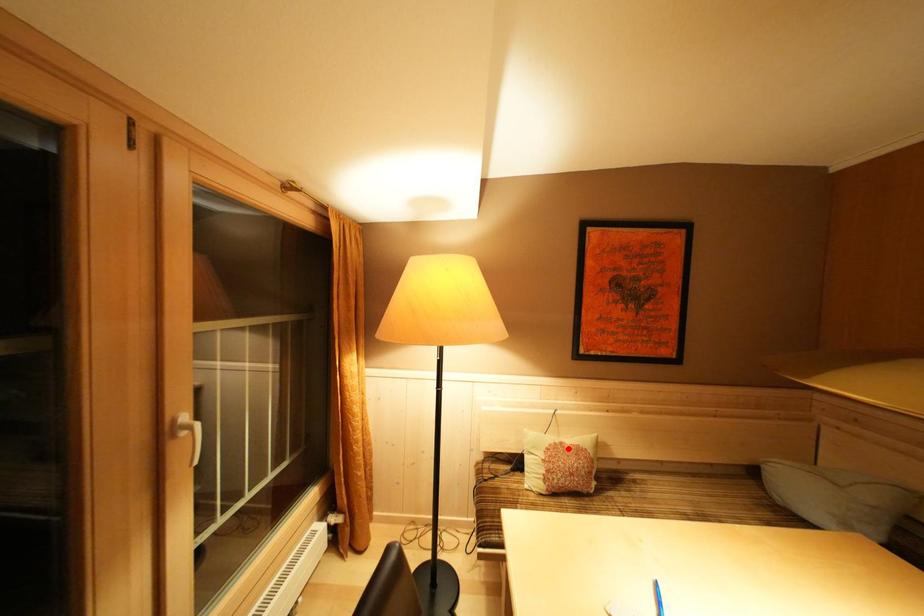
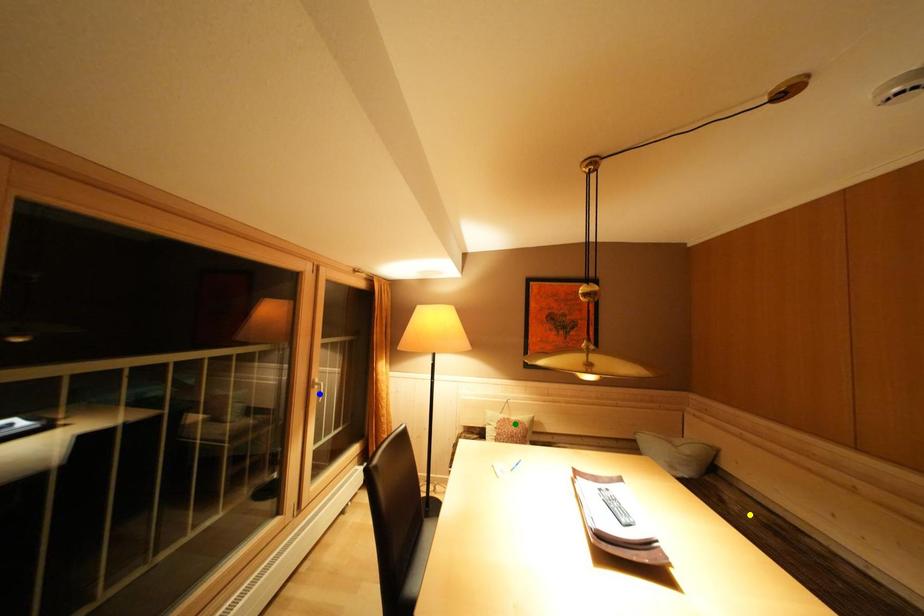
Question: I am providing you with two images of the same scene from different viewpoints. A red point is marked on the first image. You are given multiple points on the second image. Which point in image 2 represents the same 3d spot as the red point in image 1?

Choices:
 (A) yellow point
 (B) green point
 (C) blue point

Answer: (B)